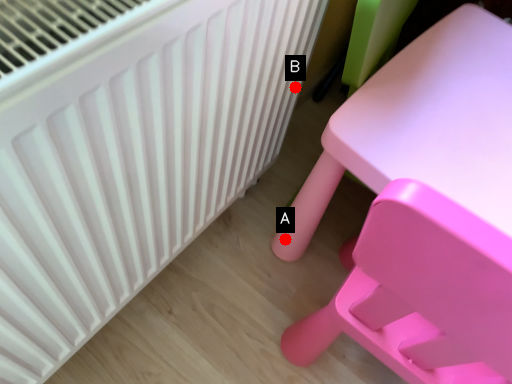
Question: Two points are circled on the image, labeled by A and B beside each circle. Which of the following is the farthest from the observer?

Choices:
 (A) A is further
 (B) B is further

Answer: (A)